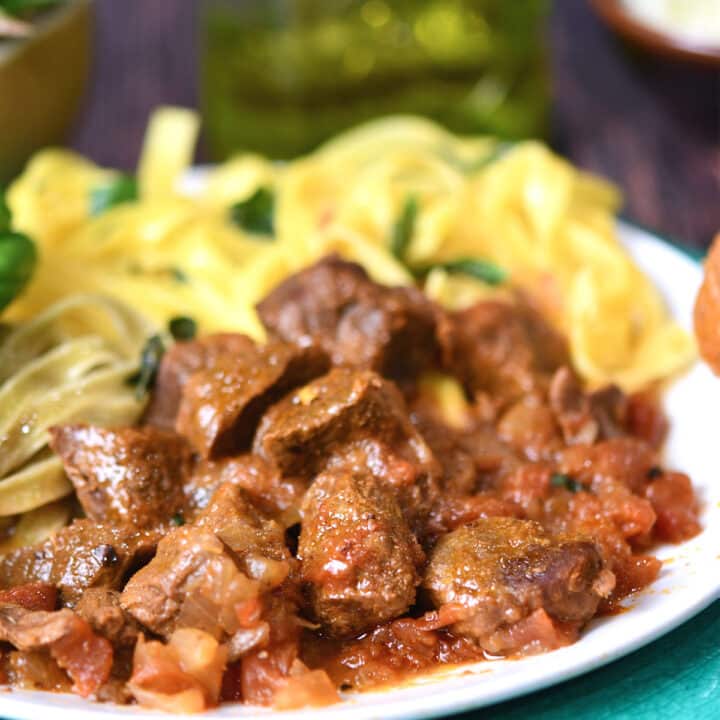
Where is `bowl`? Image resolution: width=720 pixels, height=720 pixels. bowl is located at coordinates (49, 66).